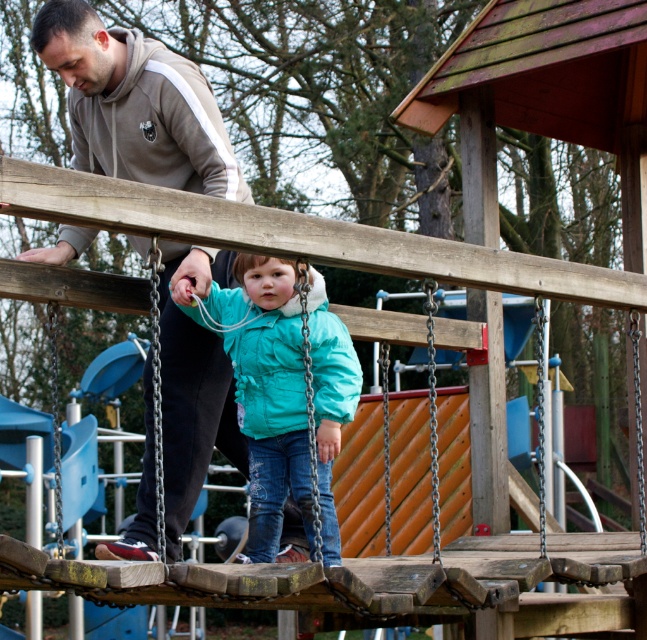
Question: In this image, where is gray fleece jacket at upper left located relative to turquoise matte jacket at center?

Choices:
 (A) below
 (B) above

Answer: (B)

Question: Which point is farther from the camera taking this photo?

Choices:
 (A) (250, 353)
 (B) (221, 403)

Answer: (B)

Question: Which object is closer to the camera taking this photo?

Choices:
 (A) gray fleece jacket at upper left
 (B) turquoise matte jacket at center

Answer: (B)

Question: Does gray fleece jacket at upper left come behind turquoise matte jacket at center?

Choices:
 (A) no
 (B) yes

Answer: (B)

Question: Considering the relative positions of gray fleece jacket at upper left and turquoise matte jacket at center in the image provided, where is gray fleece jacket at upper left located with respect to turquoise matte jacket at center?

Choices:
 (A) left
 (B) right

Answer: (A)